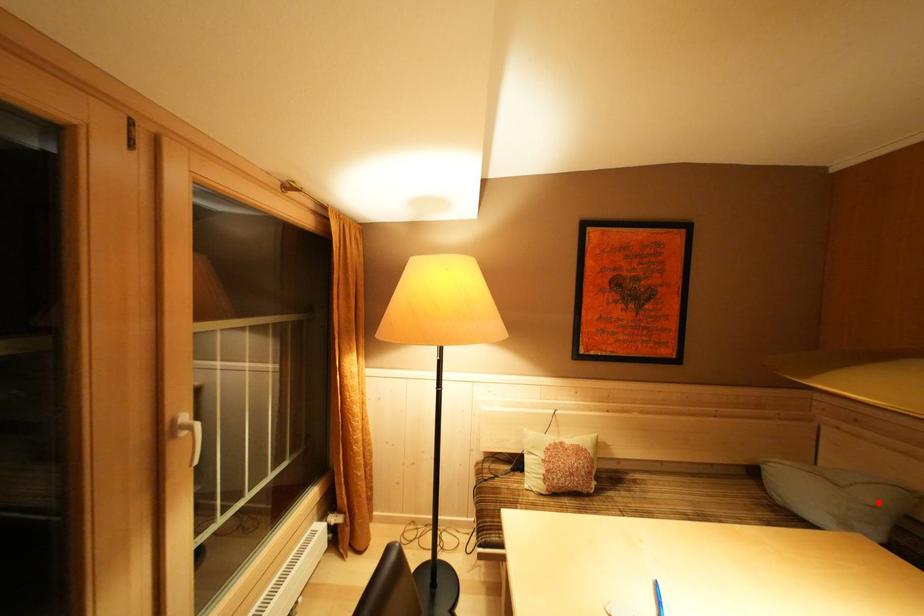
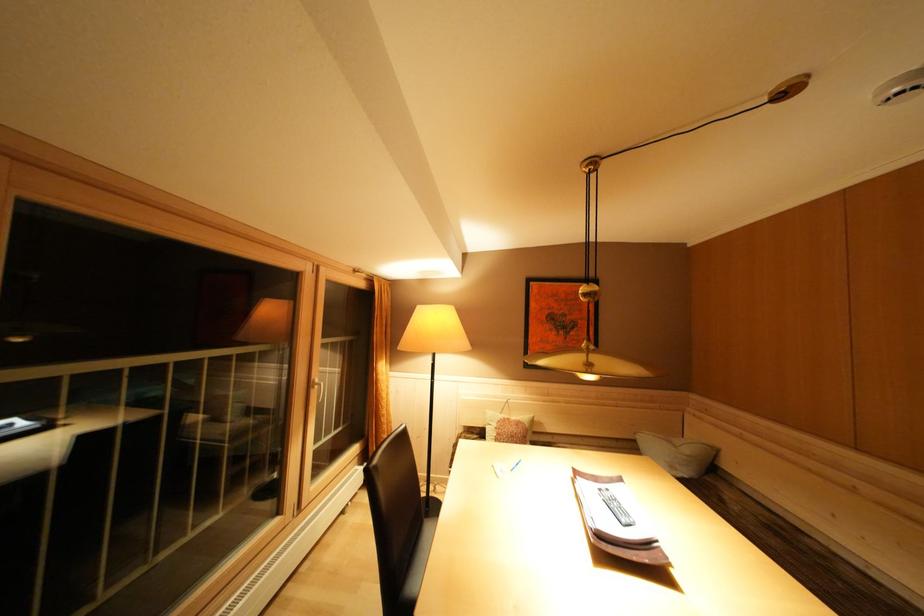
Question: I am providing you with two images of the same scene from different viewpoints. In image1, a red point is highlighted. Considering the same 3D point in image2, which of the following is correct?

Choices:
 (A) It is closer
 (B) It is farther

Answer: (B)